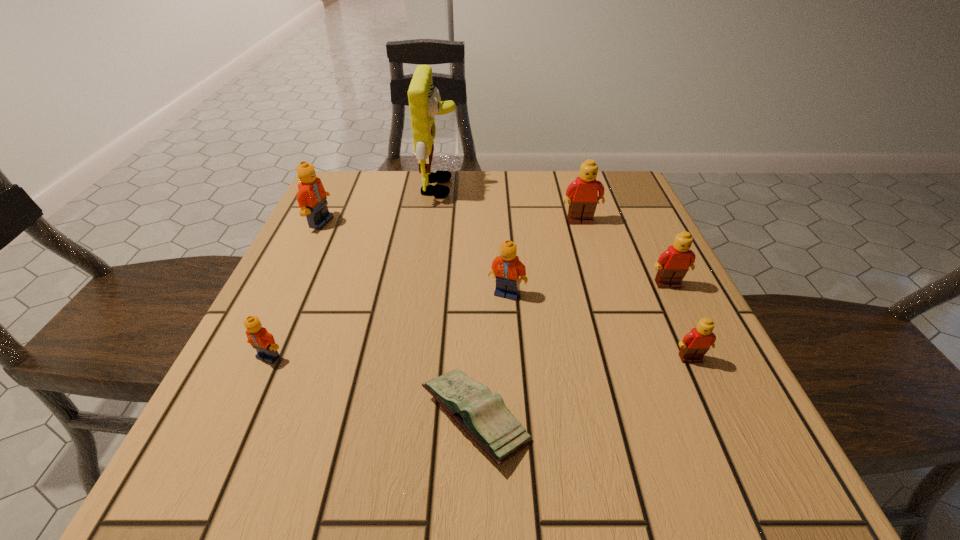
What are the coordinates of `the shortest object` in the screenshot? It's located at (484, 416).

Locate an element on the screen. Image resolution: width=960 pixels, height=540 pixels. diary is located at coordinates (484, 416).

Locate an element on the screen. free space located 0.200m on the face of the farthest object is located at coordinates (537, 187).

Locate an element on the screen. This screenshot has width=960, height=540. vacant space located 0.140m on the front-facing side of the farthest orange Lego is located at coordinates (393, 222).

Where is `vacant space located 0.400m on the face of the fourth Lego from left to right`? vacant space located 0.400m on the face of the fourth Lego from left to right is located at coordinates (625, 369).

What are the coordinates of `vacant area situated on the front-facing side of the rightmost orange Lego` in the screenshot? It's located at (518, 465).

Identify the location of free spot located on the face of the second nearest brown Lego. (709, 372).

The width and height of the screenshot is (960, 540). In order to click on vacant area located 0.070m on the front-facing side of the nearest orange Lego in this screenshot , I will do `click(248, 402)`.

At what (x,y) coordinates should I click in order to perform the action: click on vacant space located on the face of the smallest brown Lego. Please return your answer as a coordinate pair (x, y). This screenshot has height=540, width=960. Looking at the image, I should click on (709, 402).

Locate an element on the screen. vacant space located 0.110m on the right of the pink diary is located at coordinates (607, 418).